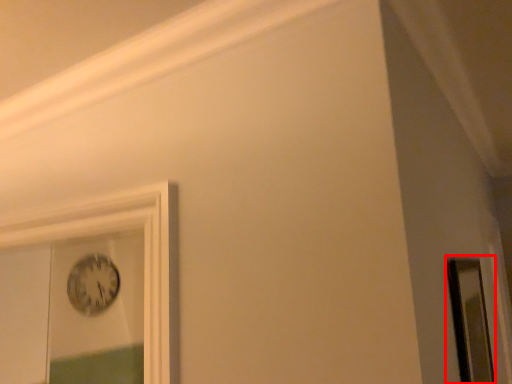
Question: From the image's perspective, where is mirror (annotated by the red box) located relative to clock?

Choices:
 (A) below
 (B) above

Answer: (B)